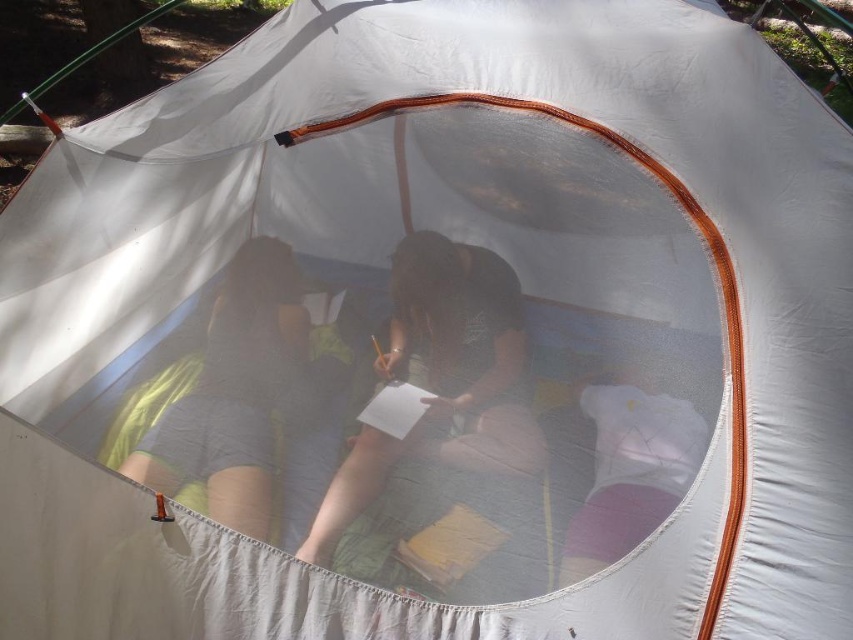
Question: Which point is farther to the camera?

Choices:
 (A) dark brown fabric at center
 (B) green fabric shorts at left

Answer: (B)

Question: Among these objects, which one is farthest from the camera?

Choices:
 (A) green fabric shorts at left
 (B) dark brown fabric at center

Answer: (A)

Question: Is dark brown fabric at center above green fabric shorts at left?

Choices:
 (A) yes
 (B) no

Answer: (B)

Question: Which of the following is the closest to the observer?

Choices:
 (A) dark brown fabric at center
 (B) green fabric shorts at left

Answer: (A)

Question: Is dark brown fabric at center thinner than green fabric shorts at left?

Choices:
 (A) no
 (B) yes

Answer: (A)

Question: Considering the relative positions of dark brown fabric at center and green fabric shorts at left in the image provided, where is dark brown fabric at center located with respect to green fabric shorts at left?

Choices:
 (A) right
 (B) left

Answer: (A)